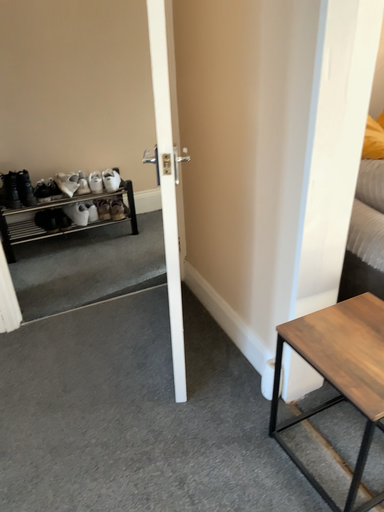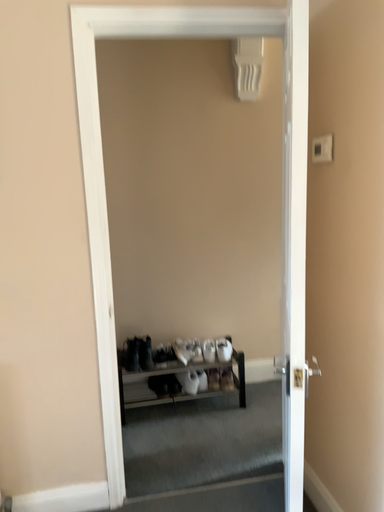
Question: How did the camera likely rotate when shooting the video?

Choices:
 (A) rotated upward
 (B) rotated downward

Answer: (A)